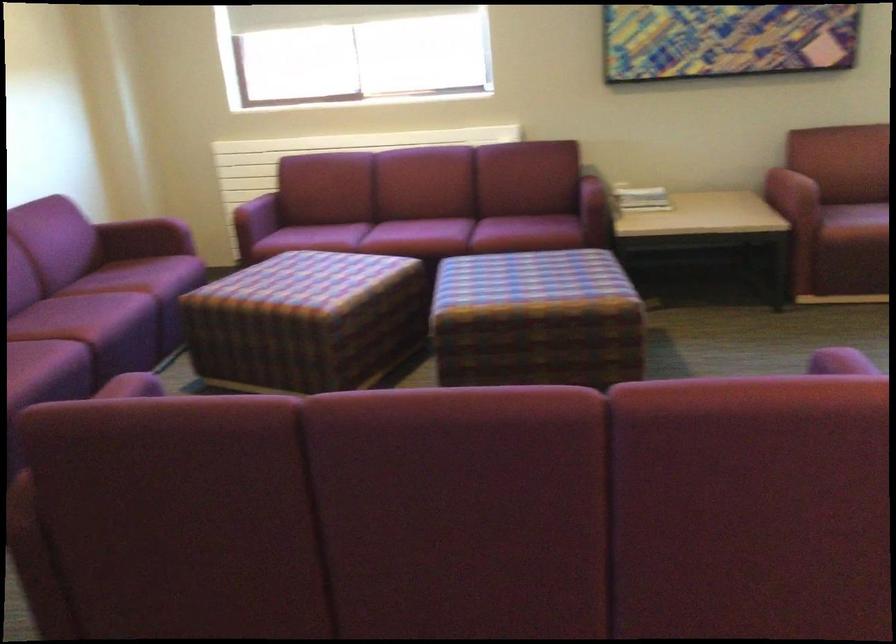
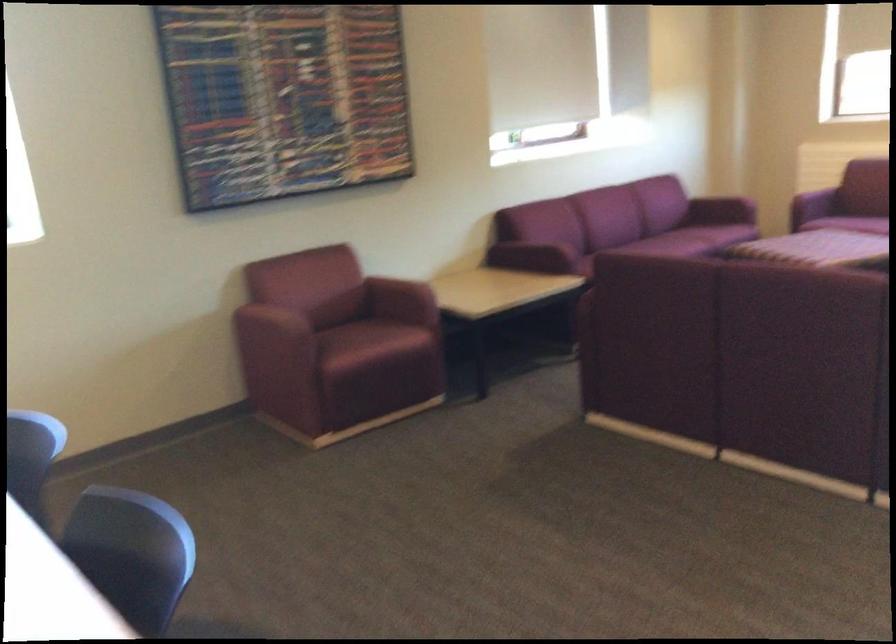
Question: I am providing you with two images of the same scene from different viewpoints. Which of the following objects are not visible in image2?

Choices:
 (A) red sofa armrest
 (B) blue binder pull-hole
 (C) maroon chair sitting surface
 (D) maroon sofa armrest

Answer: (A)